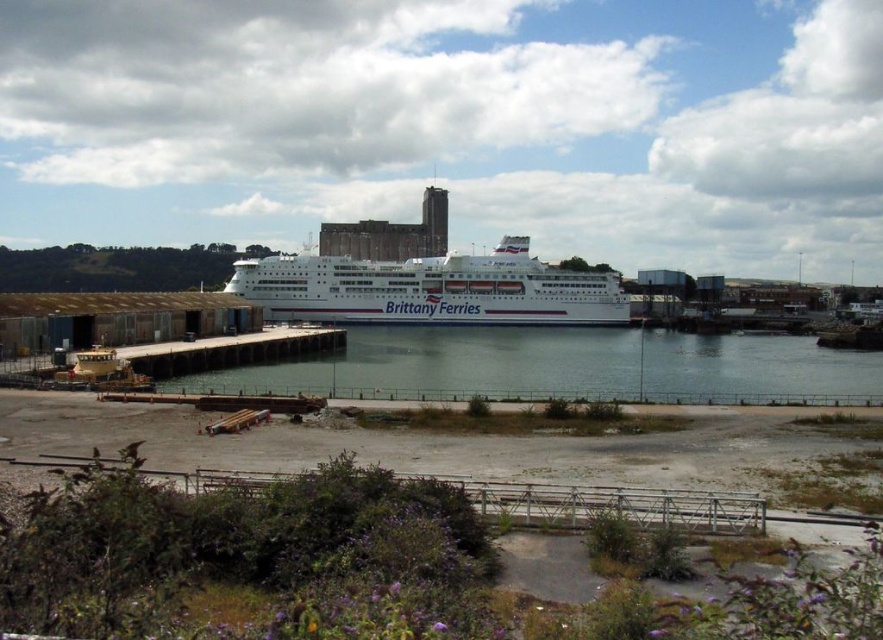
You are a sailor trying to locate the clear water at dock center. According to the coordinates provided, where exactly should you look to find it?

The clear water at dock center can be found at the coordinates point (x=565, y=365).

You are a photographer standing on the pier and want to capture both the clear water at dock center and the white glossy cruise ship at center in a single shot. Which object should you focus on first to ensure both are in frame?

The clear water at dock center is in front of the white glossy cruise ship at center, so you should focus on the clear water at dock center first to ensure both are in frame.

You are standing at the point marked as point (x=565, y=365) in the harbor scene. Based on the image, what type of surface are you currently standing on?

The point (x=565, y=365) is on clear water at dock center, so you are standing on clear water at dock center.